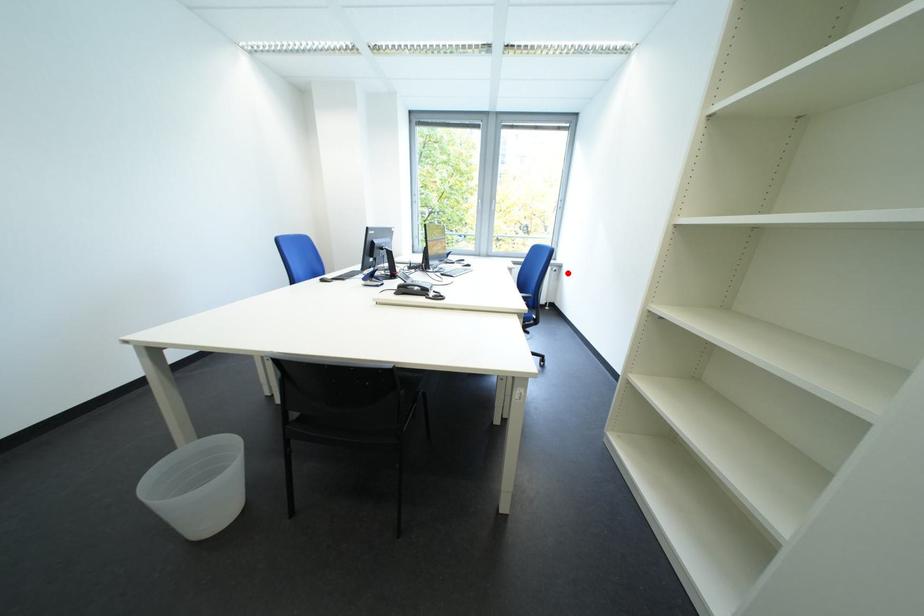
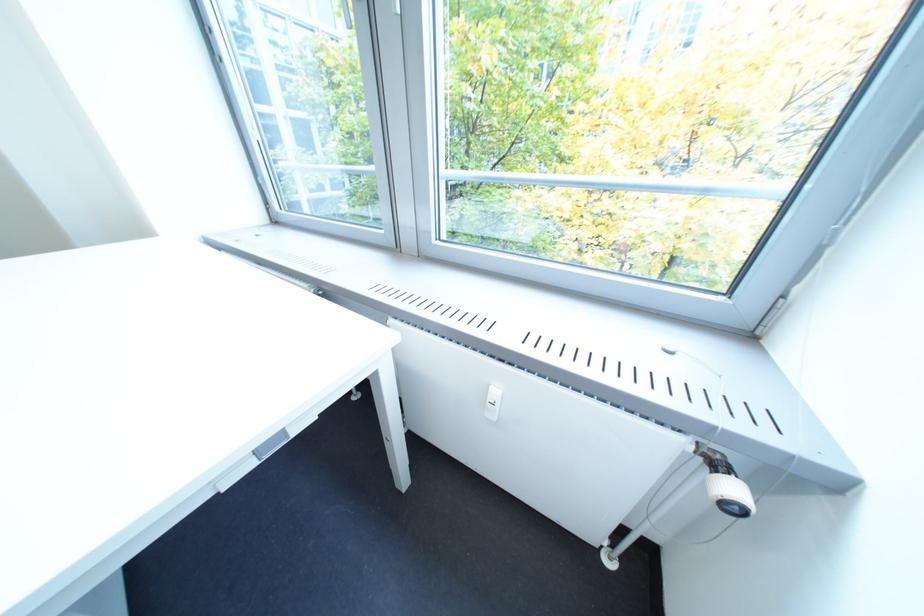
Question: A red point is marked in image1. In image2, is the corresponding 3D point closer to the camera or farther? Reply with the corresponding letter.

Choices:
 (A) The corresponding 3D point is closer.
 (B) The corresponding 3D point is farther.

Answer: (A)